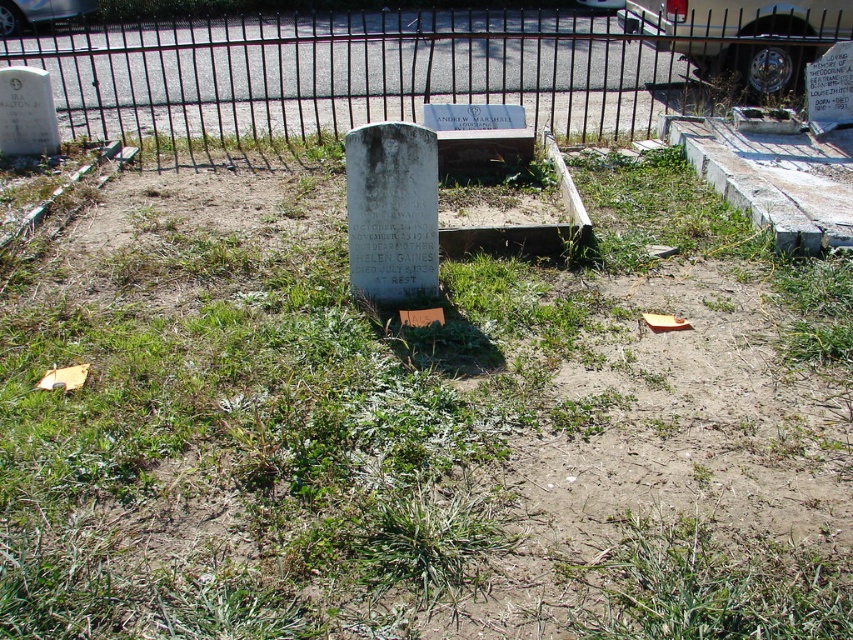
In the scene shown: Is black metal fence at upper center smaller than white marble gravestone at center?

No.

Does black metal fence at upper center have a greater height compared to white marble gravestone at center?

Correct, black metal fence at upper center is much taller as white marble gravestone at center.

The image size is (853, 640). Find the location of `black metal fence at upper center`. black metal fence at upper center is located at coordinates (412, 68).